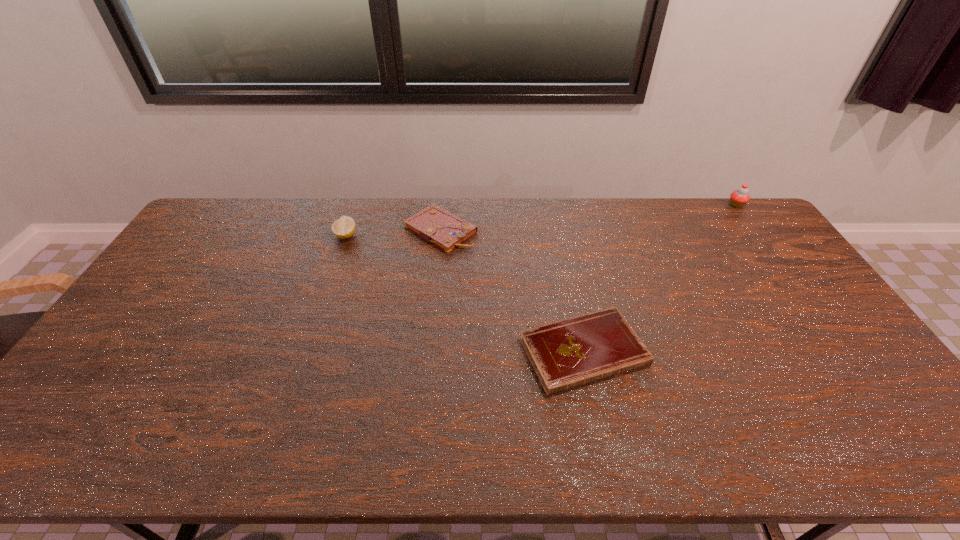
Identify the location of vacant position located on the right of the taller notebook. (570, 230).

Where is `free region located 0.050m on the right of the nearer notebook`? The width and height of the screenshot is (960, 540). free region located 0.050m on the right of the nearer notebook is located at coordinates (665, 352).

The image size is (960, 540). I want to click on cupcake present at the far edge, so click(x=738, y=198).

The width and height of the screenshot is (960, 540). I want to click on lemon that is at the far edge, so click(x=343, y=228).

Where is `notebook positioned at the far edge`? notebook positioned at the far edge is located at coordinates (434, 224).

This screenshot has height=540, width=960. I want to click on object located in the right edge section of the desktop, so click(x=738, y=198).

I want to click on object situated at the far right corner, so click(738, 198).

At what (x,y) coordinates should I click in order to perform the action: click on free space at the far edge of the desktop. Please return your answer as a coordinate pair (x, y). This screenshot has height=540, width=960. Looking at the image, I should click on (492, 202).

What are the coordinates of `vacant space at the near edge of the desktop` in the screenshot? It's located at (660, 433).

Image resolution: width=960 pixels, height=540 pixels. Identify the location of free space at the left edge of the desktop. (92, 381).